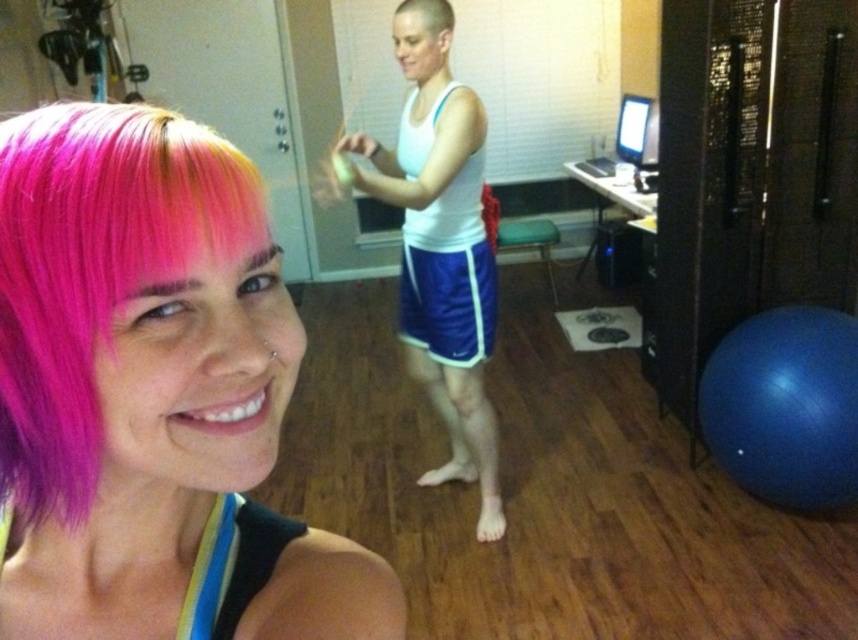
You are a fitness trainer assessing the workout space. You need to ensure there is enough room between the blue fabric shorts at center and the shiny white hair at center for a client to perform a stretching exercise. The minimum required space is 30 inches. Is the current distance sufficient?

The distance between the blue fabric shorts at center and the shiny white hair at center is 29.65 inches, which is slightly less than the required 30 inches. Therefore, the current space is insufficient for the stretching exercise.

You are a photographer setting up for a photoshoot in this home gym. You need to ensure that the white matte tank top at center is in focus while keeping the background blurred. Given that the tank top is 1.81 meters away from the camera, what should be the minimum distance you set your camera focus to achieve this?

To ensure the white matte tank top at center is in focus while blurring the background, the camera focus should be set to at least 1.81 meters, matching the distance of the tank top from the camera.

You are designing a layout for a fitness app that needs to highlight the blue fabric shorts at center. According to the image, where exactly should you place the focus point of the app interface to align with the shorts?

The focus point should be placed at coordinates point (x=449, y=301) to align with the blue fabric shorts at center as specified in the description.